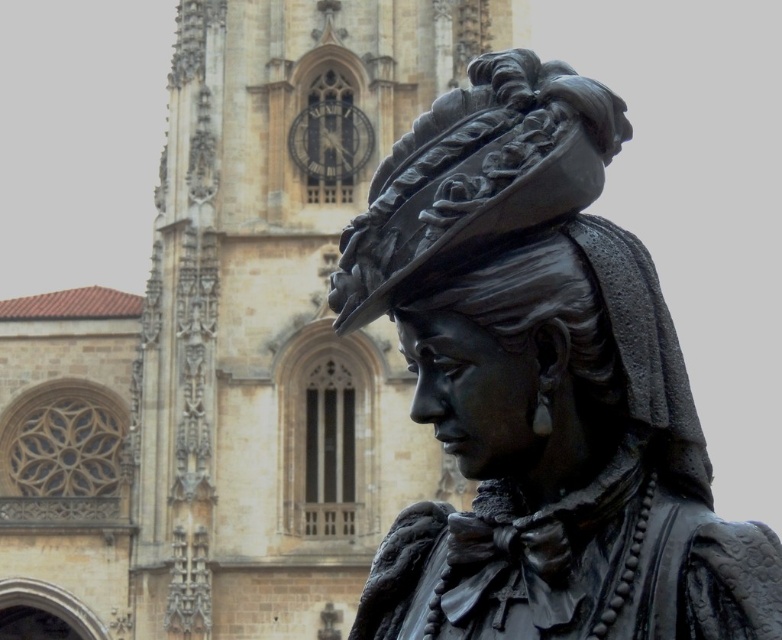
Does beige stone church at center appear over black polished statue at center?

Correct, beige stone church at center is located above black polished statue at center.

Between beige stone church at center and black polished statue at center, which one appears on the left side from the viewer's perspective?

Positioned to the left is beige stone church at center.

Is point (325, 545) more distant than point (391, 211)?

Yes, point (325, 545) is behind point (391, 211).

Identify the location of beige stone church at center. (230, 346).